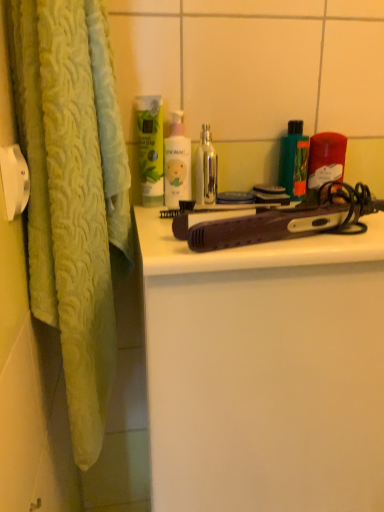
Question: Considering their positions, is metallic silver bottle at center located in front of or behind purple plastic hair straightener at center?

Choices:
 (A) behind
 (B) front

Answer: (A)

Question: From a real-world perspective, is metallic silver bottle at center positioned above or below purple plastic hair straightener at center?

Choices:
 (A) below
 (B) above

Answer: (B)

Question: Estimate the real-world distances between objects in this image. Which object is closer to the white matte bottle at center, which is counted as the first cleaning product, starting from the right?

Choices:
 (A) purple plastic hair straightener at center
 (B) metallic silver bottle at center
 (C) green matte lotion at upper center, which is the 1th cleaning product in left-to-right order
 (D) translucent plastic container at upper right, which ranks as the 1th product in right-to-left order
 (E) green matte bottle at upper right, arranged as the 2th product when viewed from the right

Answer: (C)

Question: Which is nearer to the translucent plastic container at upper right, which ranks as the 1th product in right-to-left order?

Choices:
 (A) purple plastic hair straightener at center
 (B) purple plastic hair straightener at center
 (C) green matte bottle at upper right, arranged as the 2th product when viewed from the right
 (D) metallic silver bottle at center
 (E) green matte lotion at upper center, which is the 1th cleaning product in left-to-right order

Answer: (C)